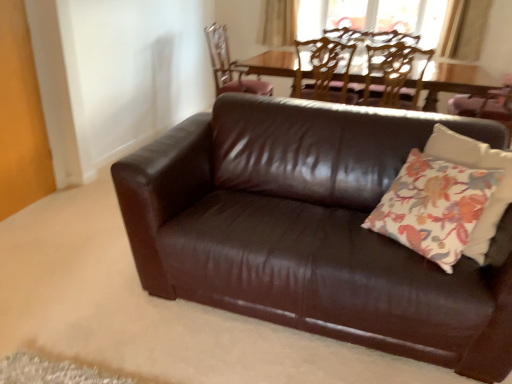
Question: Which direction should I rotate to look at wooden chair at upper center, positioned as the 1th chair in left-to-right order?

Choices:
 (A) right
 (B) left

Answer: (B)

Question: Is brown leather chair at upper center, the 2th chair viewed from the right, at the back of beige fabric curtain at upper center?

Choices:
 (A) yes
 (B) no

Answer: (B)

Question: Is beige fabric curtain at upper center shorter than brown leather chair at upper center, marked as the second chair in a left-to-right arrangement?

Choices:
 (A) no
 (B) yes

Answer: (B)

Question: From the image's perspective, would you say beige fabric curtain at upper center is shown under brown leather chair at upper center, marked as the second chair in a left-to-right arrangement?

Choices:
 (A) yes
 (B) no

Answer: (B)

Question: Is beige fabric curtain at upper center thinner than brown leather chair at upper center, the 2th chair viewed from the right?

Choices:
 (A) yes
 (B) no

Answer: (A)

Question: Would you consider beige fabric curtain at upper center to be distant from brown leather chair at upper center, marked as the second chair in a left-to-right arrangement?

Choices:
 (A) yes
 (B) no

Answer: (A)

Question: Is beige fabric curtain at upper center positioned behind brown leather chair at upper center, the 2th chair viewed from the right?

Choices:
 (A) yes
 (B) no

Answer: (A)

Question: Considering the relative sizes of wooden chair at upper center, the 3th chair from the right, and floral fabric pillow at center in the image provided, is wooden chair at upper center, the 3th chair from the right, wider than floral fabric pillow at center?

Choices:
 (A) no
 (B) yes

Answer: (B)

Question: From the image's perspective, is wooden chair at upper center, positioned as the 1th chair in left-to-right order, under floral fabric pillow at center?

Choices:
 (A) no
 (B) yes

Answer: (A)

Question: From the image's perspective, is wooden chair at upper center, the 3th chair from the right, on floral fabric pillow at center?

Choices:
 (A) yes
 (B) no

Answer: (A)

Question: Considering the relative positions of wooden chair at upper center, positioned as the 1th chair in left-to-right order, and floral fabric pillow at center in the image provided, is wooden chair at upper center, positioned as the 1th chair in left-to-right order, to the right of floral fabric pillow at center from the viewer's perspective?

Choices:
 (A) yes
 (B) no

Answer: (B)

Question: Can you confirm if wooden chair at upper center, positioned as the 1th chair in left-to-right order, is positioned to the left of floral fabric pillow at center?

Choices:
 (A) yes
 (B) no

Answer: (A)

Question: Can you confirm if wooden chair at upper center, positioned as the 1th chair in left-to-right order, is smaller than floral fabric pillow at center?

Choices:
 (A) yes
 (B) no

Answer: (B)

Question: Is wooden chair at upper center, the 3th chair from the right, wider than wooden textured chair at upper center, the 1th chair when ordered from right to left?

Choices:
 (A) no
 (B) yes

Answer: (B)